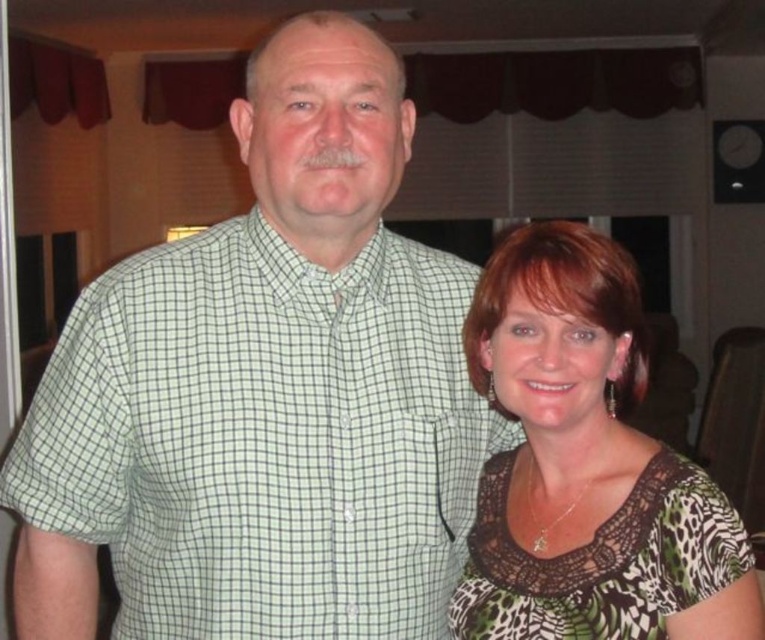
You are designing a layout for a photo album and need to place the green checkered shirt at center and the printed fabric blouse at right in a vertical column. Given their heights, which one should you place first at the bottom to ensure the taller item is at the bottom?

The green checkered shirt at center is much taller than the printed fabric blouse at right, so you should place the green checkered shirt at center first at the bottom to ensure the taller item is placed at the bottom.

You are a tailor measuring clothes for a customer. You need to determine which garment is more suitable for a client who requires a larger size. Based on the image, which of the two garments, the green checkered shirt at center or the printed fabric blouse at right, is larger?

The printed fabric blouse at right is larger than the green checkered shirt at center, so it would be more suitable for a client requiring a larger size.